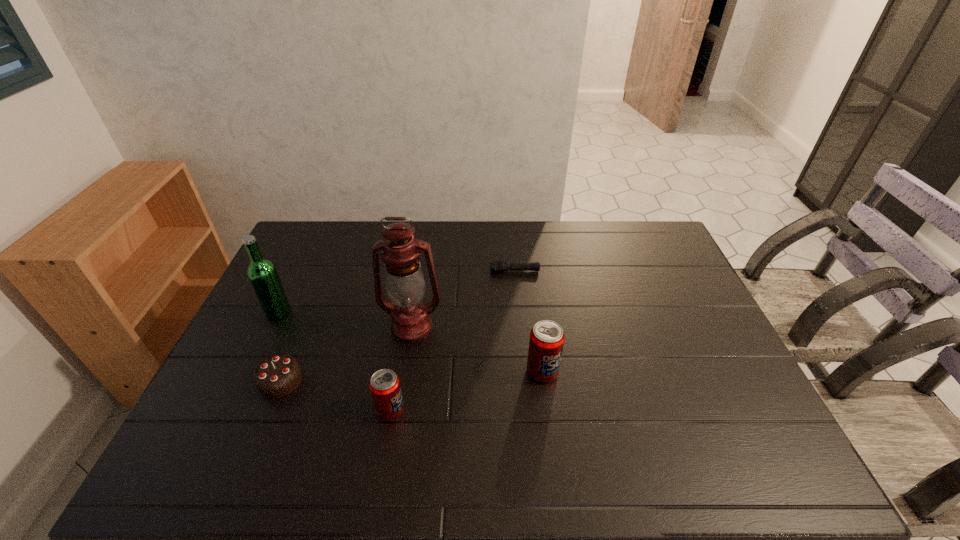
I want to click on free space between the chocolate cake and the tallest object, so (x=347, y=354).

Where is `free spot between the third shortest object and the farthest object`? This screenshot has height=540, width=960. free spot between the third shortest object and the farthest object is located at coordinates (453, 341).

Identify the location of vacant space that's between the shortest object and the left soda can. (453, 341).

Identify the location of free spot between the farthest object and the right soda can. (529, 321).

The height and width of the screenshot is (540, 960). I want to click on free space between the tallest object and the chocolate cake, so click(x=347, y=354).

Locate which object ranks fourth in proximity to the fifth tallest object. Please provide its 2D coordinates. Your answer should be formatted as a tuple, i.e. [(x, y)], where the tuple contains the x and y coordinates of a point satisfying the conditions above.

[(546, 342)]

Where is `the second closest object relative to the oil lamp`? This screenshot has height=540, width=960. the second closest object relative to the oil lamp is located at coordinates (278, 375).

Identify the location of vacant space that satisfies the following two spatial constraints: 1. on the front side of the left soda can; 2. on the left side of the chocolate cake. (269, 410).

Where is `blank area in the image that satisfies the following two spatial constraints: 1. on the front side of the beer bottle; 2. on the right side of the second shortest object`? blank area in the image that satisfies the following two spatial constraints: 1. on the front side of the beer bottle; 2. on the right side of the second shortest object is located at coordinates (245, 381).

At what (x,y) coordinates should I click in order to perform the action: click on blank area in the image that satisfies the following two spatial constraints: 1. at the lens end of the taller soda can; 2. on the right side of the flashlight. Please return your answer as a coordinate pair (x, y). The image size is (960, 540). Looking at the image, I should click on (524, 372).